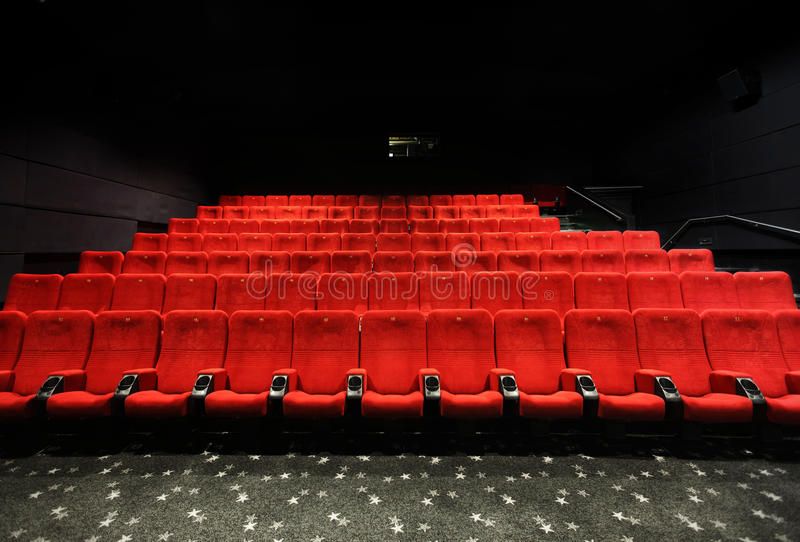
Locate an element on the screen. cup holders is located at coordinates (750, 386), (665, 389), (585, 386), (509, 386), (430, 385), (354, 384), (278, 383), (201, 383), (125, 384), (50, 384).